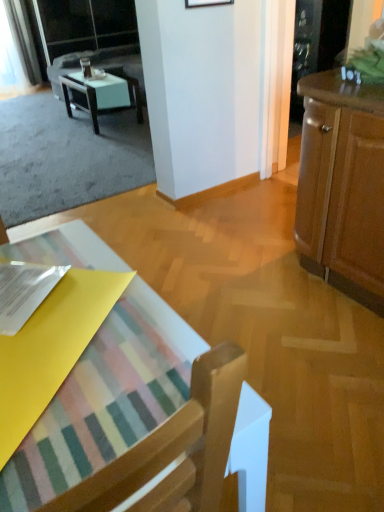
Question: Should I look upward or downward to see transparent glass screen door at upper left, which appears as the first screen door when viewed from the back?

Choices:
 (A) up
 (B) down

Answer: (A)

Question: Considering the relative sizes of wooden cabinet at right and white glossy table at upper left in the image provided, is wooden cabinet at right smaller than white glossy table at upper left?

Choices:
 (A) yes
 (B) no

Answer: (B)

Question: Is wooden cabinet at right completely or partially outside of white glossy table at upper left?

Choices:
 (A) yes
 (B) no

Answer: (A)

Question: From a real-world perspective, is wooden cabinet at right on top of white glossy table at upper left?

Choices:
 (A) no
 (B) yes

Answer: (B)

Question: Is white glossy table at upper left at the back of wooden cabinet at right?

Choices:
 (A) no
 (B) yes

Answer: (A)

Question: Can you confirm if wooden cabinet at right is bigger than white glossy table at upper left?

Choices:
 (A) yes
 (B) no

Answer: (A)

Question: Considering the relative sizes of wooden cabinet at right and white glossy table at upper left in the image provided, is wooden cabinet at right shorter than white glossy table at upper left?

Choices:
 (A) yes
 (B) no

Answer: (B)

Question: Considering the relative positions of transparent glass cabinet at upper right, acting as the 2th screen door starting from the left, and wooden picture frame at upper center in the image provided, is transparent glass cabinet at upper right, acting as the 2th screen door starting from the left, behind wooden picture frame at upper center?

Choices:
 (A) no
 (B) yes

Answer: (B)

Question: Is transparent glass cabinet at upper right, the 1th screen door in the bottom-to-top sequence, directly adjacent to wooden picture frame at upper center?

Choices:
 (A) yes
 (B) no

Answer: (B)

Question: Can you confirm if transparent glass cabinet at upper right, the 1th screen door in the bottom-to-top sequence, is positioned to the left of wooden picture frame at upper center?

Choices:
 (A) yes
 (B) no

Answer: (B)

Question: Is transparent glass cabinet at upper right, which ranks as the 1th screen door in front-to-back order, bigger than wooden picture frame at upper center?

Choices:
 (A) yes
 (B) no

Answer: (A)

Question: Can we say transparent glass cabinet at upper right, the 1th screen door in the bottom-to-top sequence, lies outside wooden picture frame at upper center?

Choices:
 (A) no
 (B) yes

Answer: (B)

Question: Is transparent glass cabinet at upper right, which ranks as the 1th screen door in front-to-back order, facing towards wooden picture frame at upper center?

Choices:
 (A) no
 (B) yes

Answer: (A)

Question: From a real-world perspective, does transparent glass screen door at upper left, the first screen door in the top-to-bottom sequence, stand above transparent glass cabinet at upper right, acting as the 2th screen door starting from the left?

Choices:
 (A) yes
 (B) no

Answer: (A)